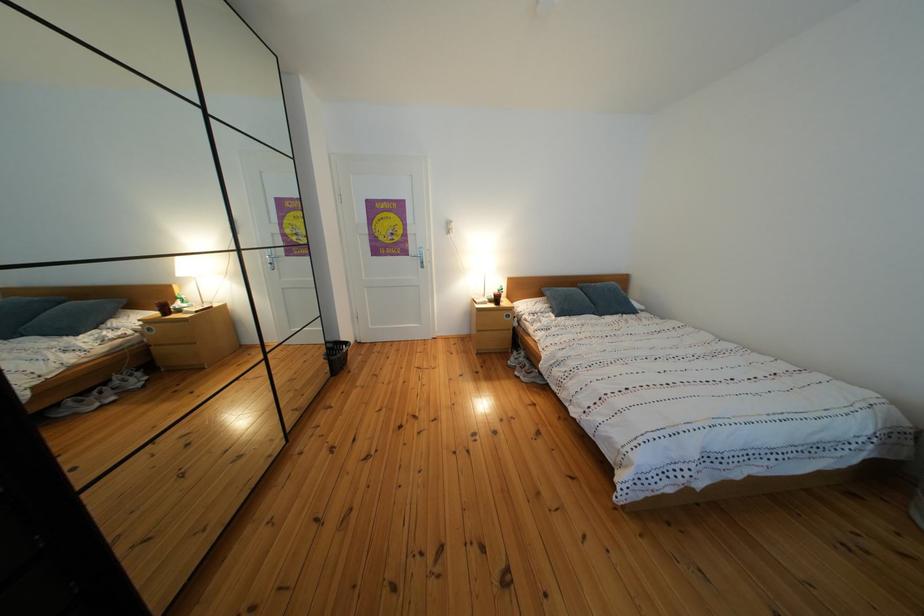
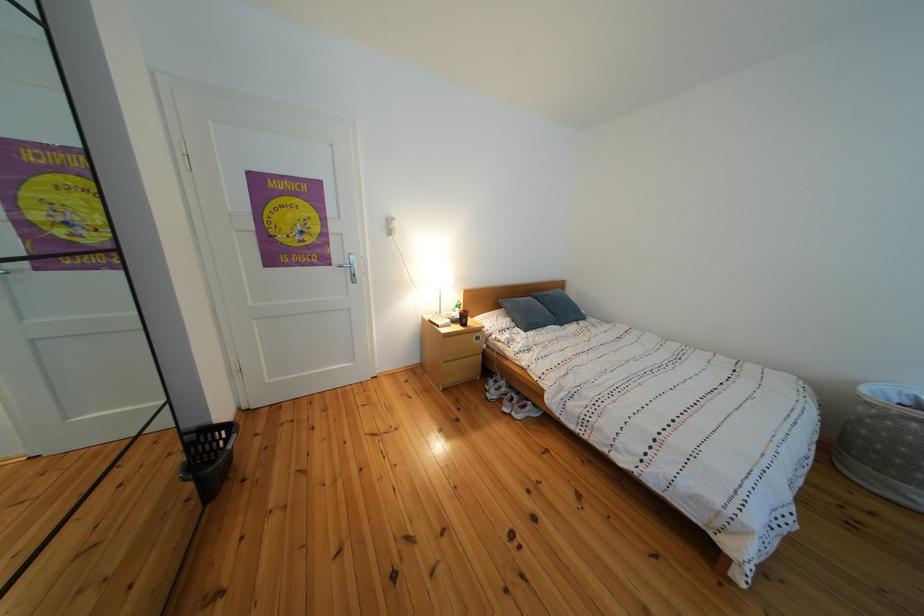
The point at (343, 351) is marked in the first image. Where is the corresponding point in the second image?

(201, 444)